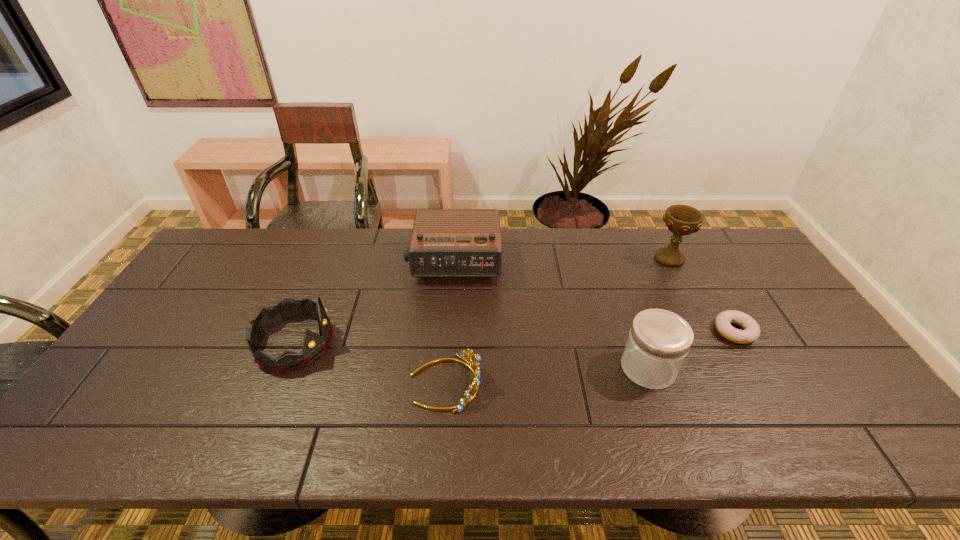
Find the location of a particular element. Image resolution: width=960 pixels, height=540 pixels. object that ranks as the second closest to the doughnut is located at coordinates (681, 220).

This screenshot has width=960, height=540. Find the location of `free region that satisfies the following two spatial constraints: 1. on the front panel of the radio receiver; 2. on the right side of the jar`. free region that satisfies the following two spatial constraints: 1. on the front panel of the radio receiver; 2. on the right side of the jar is located at coordinates (447, 368).

At what (x,y) coordinates should I click in order to perform the action: click on free region that satisfies the following two spatial constraints: 1. on the front side of the shortest object; 2. on the front-facing side of the right tiara. Please return your answer as a coordinate pair (x, y). Looking at the image, I should click on (765, 383).

Find the location of a particular element. vacant space that satisfies the following two spatial constraints: 1. on the front panel of the radio receiver; 2. on the front-facing side of the second shortest object is located at coordinates (446, 383).

Where is `vacant space that satisfies the following two spatial constraints: 1. at the front of the taller tiara with jewels; 2. on the left side of the jar`? The image size is (960, 540). vacant space that satisfies the following two spatial constraints: 1. at the front of the taller tiara with jewels; 2. on the left side of the jar is located at coordinates (284, 368).